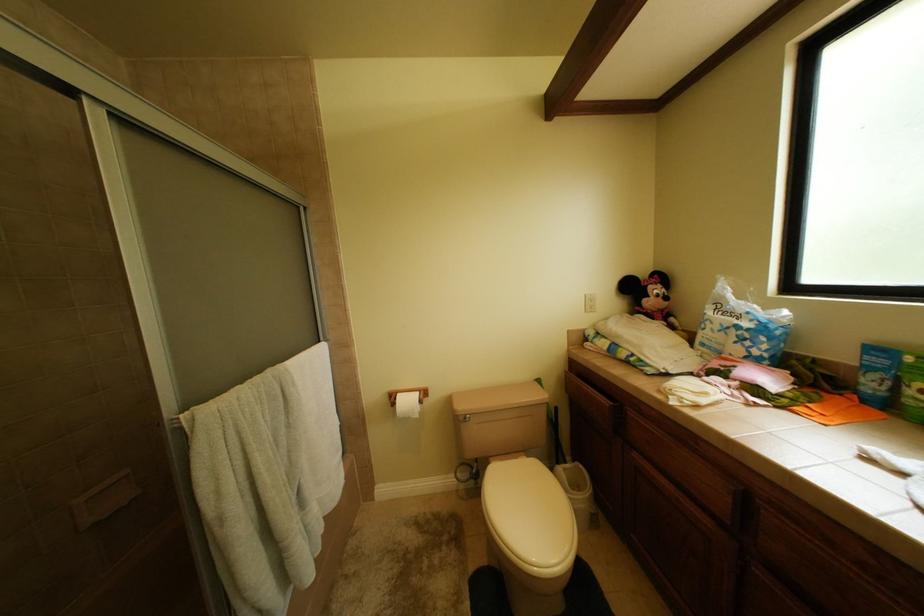
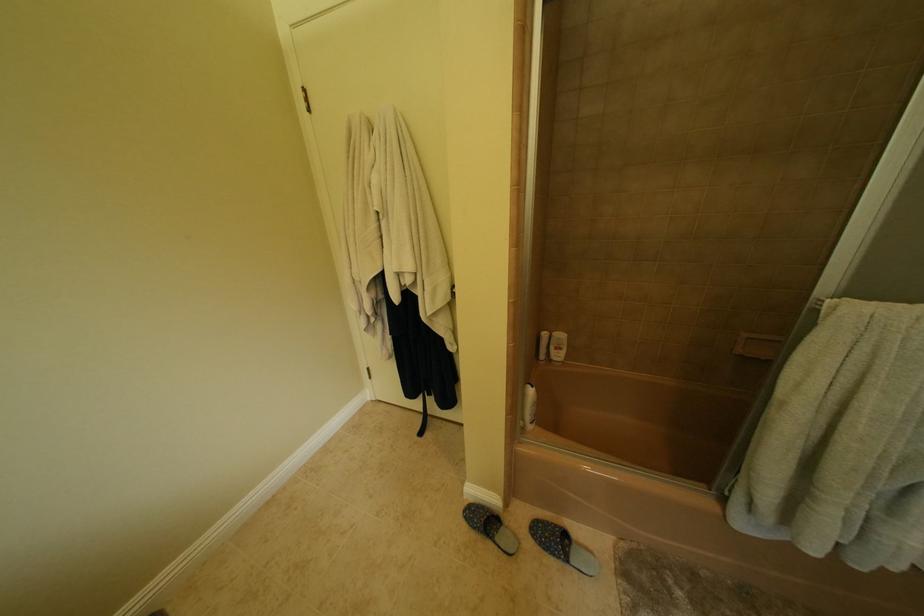
Based on the continuous images, in which direction is the camera rotating?

The camera's rotation is toward left-down.